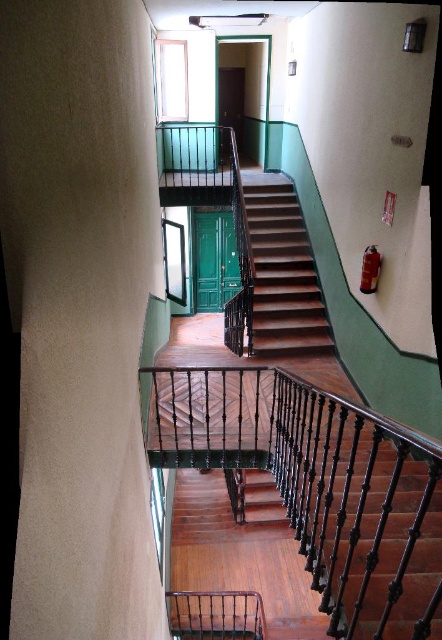
Which is in front, point (269, 189) or point (205, 592)?

Point (205, 592) is in front.

Does point (258, 244) come closer to viewer compared to point (209, 612)?

No, (258, 244) is further to viewer.

Identify the location of wooden stairs at center. This screenshot has width=442, height=640. (281, 272).